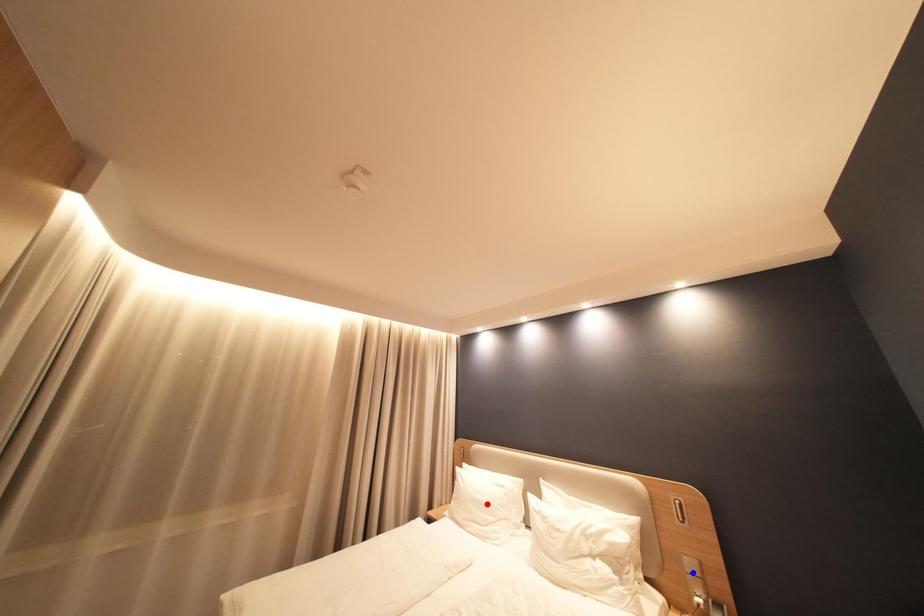
Question: Two points are marked on the image. Which point is closer to the camera?

Choices:
 (A) Blue point is closer.
 (B) Red point is closer.

Answer: (A)